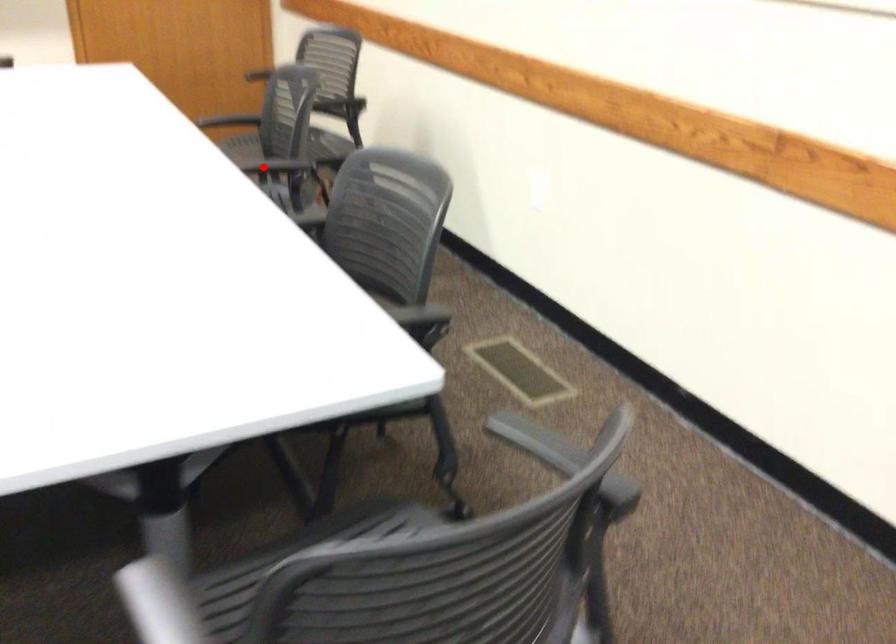
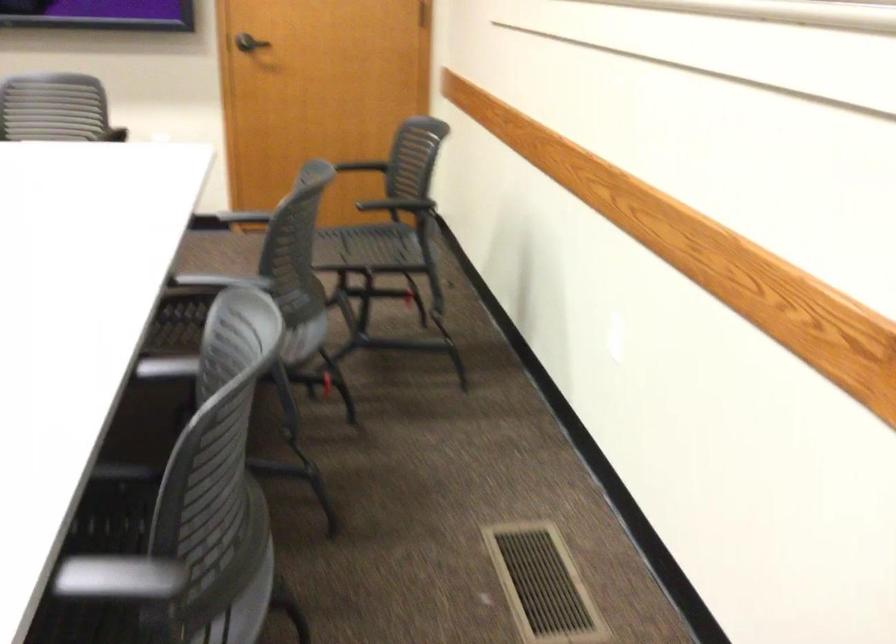
In the second image, find the point that corresponds to the highlighted location in the first image.

(220, 281)